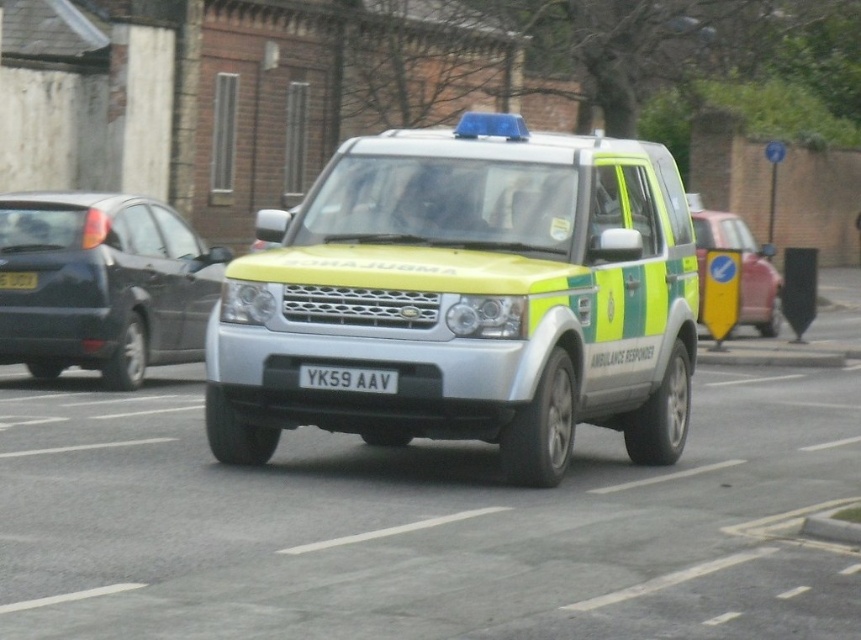
Image resolution: width=861 pixels, height=640 pixels. Describe the element at coordinates (468, 298) in the screenshot. I see `metallic silver ambulance at center` at that location.

Between metallic silver ambulance at center and yellow matte license plate at center, which one has less height?

Standing shorter between the two is yellow matte license plate at center.

Does point (468, 125) come behind point (382, 380)?

Yes.

Where is `metallic silver ambulance at center`? The height and width of the screenshot is (640, 861). metallic silver ambulance at center is located at coordinates (468, 298).

Which is below, yellow-green plastic sign at right or yellow matte license plate at center?

yellow matte license plate at center is below.

Where is `yellow-green plastic sign at right`? Image resolution: width=861 pixels, height=640 pixels. yellow-green plastic sign at right is located at coordinates (740, 266).

Between metallic silver ambulance at center and yellow-green plastic sign at right, which one is positioned higher?

yellow-green plastic sign at right

Is point (456, 420) closer to viewer compared to point (729, 216)?

Yes.

Does point (692, 340) lie in front of point (702, 260)?

Yes, point (692, 340) is in front of point (702, 260).

Identify the location of metallic silver ambulance at center. (468, 298).